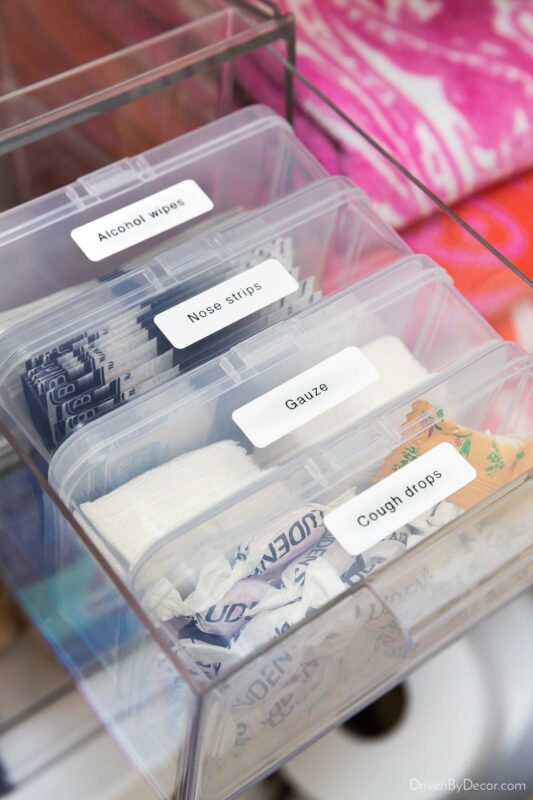
Locate an element on the screen. drawer  handle is located at coordinates (466, 578).